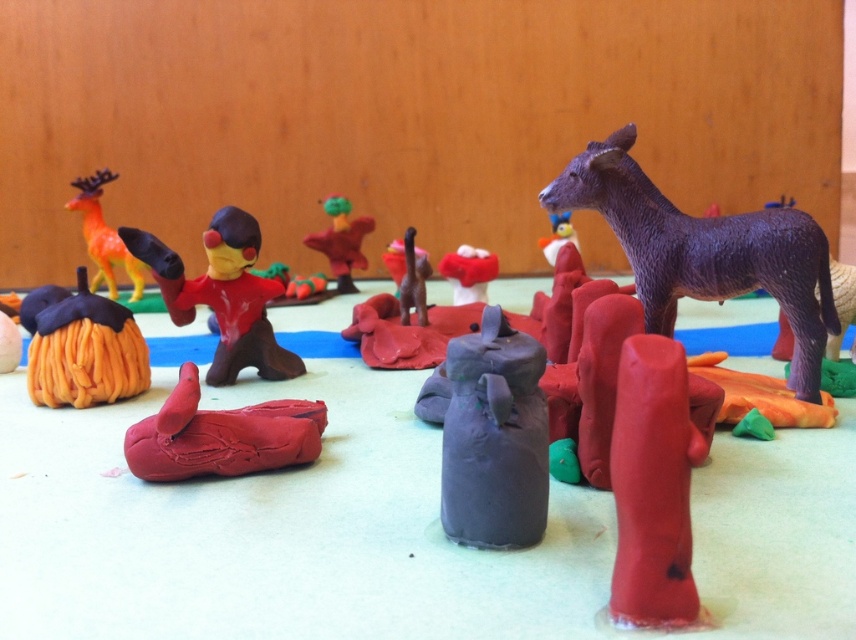
Question: Which object is positioned closest to the rubberized red stick at center?

Choices:
 (A) matte plastic figure at center
 (B) matte gray jug at center
 (C) rubber duck at center

Answer: (B)

Question: Estimate the real-world distances between objects in this image. Which object is farther from the purple matte donkey at upper right?

Choices:
 (A) matte gray jug at center
 (B) rubber duck at lower left
 (C) orange yarn pumpkin at lower left

Answer: (C)

Question: Does rubberized red stick at center have a smaller size compared to matte red mushroom at center?

Choices:
 (A) yes
 (B) no

Answer: (B)

Question: Observing the image, what is the correct spatial positioning of matte gray jug at center in reference to rubber duck at lower left?

Choices:
 (A) above
 (B) below

Answer: (A)

Question: Estimate the real-world distances between objects in this image. Which object is closer to the matte gray jug at center?

Choices:
 (A) matte plastic figure at center
 (B) rubberized red stick at center

Answer: (B)

Question: Does purple matte donkey at upper right appear on the left side of rubber duck at center?

Choices:
 (A) yes
 (B) no

Answer: (B)